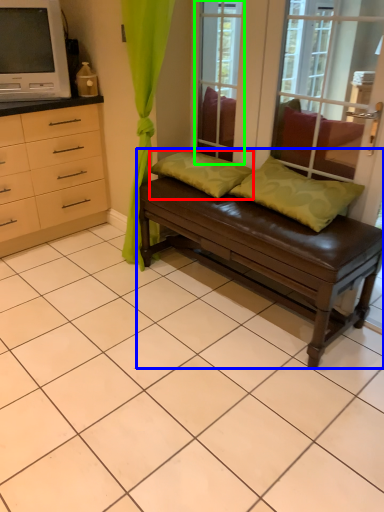
Question: Considering the real-world distances, which object is closest to pillow (highlighted by a red box)? studio couch (highlighted by a blue box) or window screen (highlighted by a green box).

Choices:
 (A) studio couch
 (B) window screen

Answer: (A)